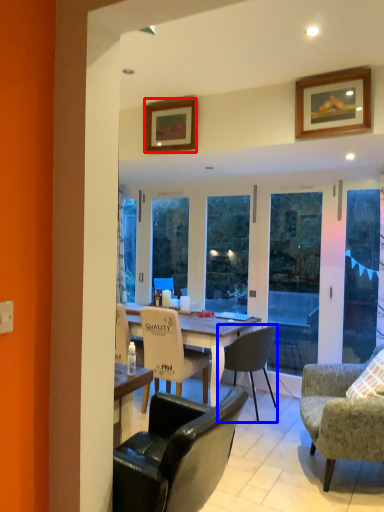
Question: Which object appears farthest to the camera in this image, picture frame (highlighted by a red box) or chair (highlighted by a blue box)?

Choices:
 (A) picture frame
 (B) chair

Answer: (B)